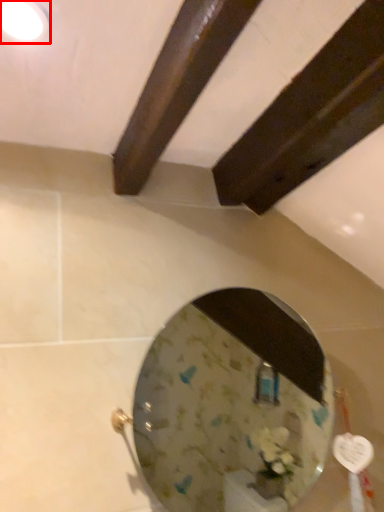
Question: From the image's perspective, where is light fixture (annotated by the red box) located in relation to mirror in the image?

Choices:
 (A) above
 (B) below

Answer: (A)